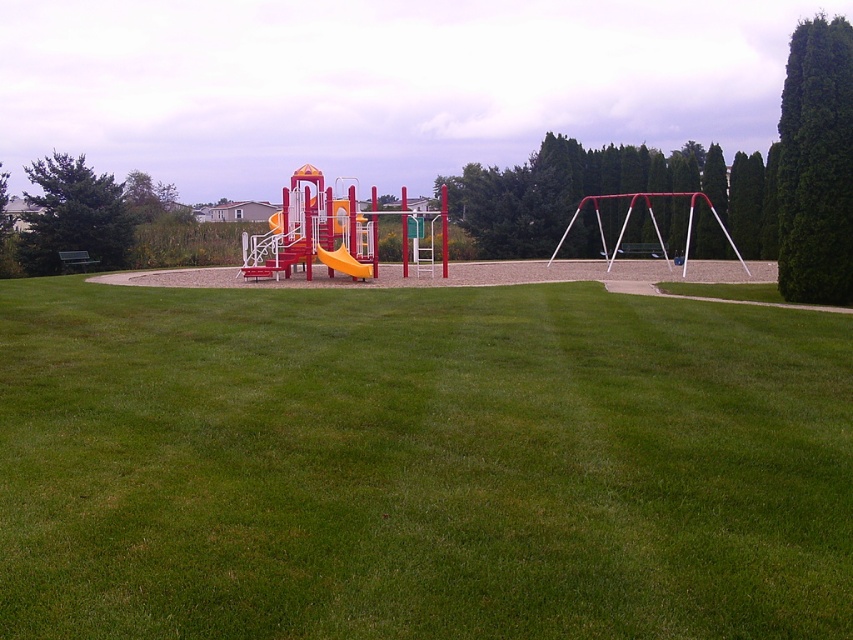
Who is positioned more to the right, green grassy field at center or green leafy cypress tree at left?

green grassy field at center

Is green grassy field at center positioned behind green leafy cypress tree at left?

No, it is not.

Does point (175, 371) lie behind point (86, 172)?

That is False.

Where is `green grassy field at center`? green grassy field at center is located at coordinates (419, 464).

Is green leafy cypress at upper right shorter than orange matte slide at center?

No.

Is green leafy cypress at upper right thinner than orange matte slide at center?

No, green leafy cypress at upper right is not thinner than orange matte slide at center.

The image size is (853, 640). Find the location of `green leafy cypress at upper right`. green leafy cypress at upper right is located at coordinates (816, 164).

Where is `green leafy cypress at upper right`? The height and width of the screenshot is (640, 853). green leafy cypress at upper right is located at coordinates (816, 164).

Can you confirm if green grassy field at center is thinner than orange matte slide at center?

No, green grassy field at center is not thinner than orange matte slide at center.

Is point (670, 538) positioned behind point (364, 275)?

No.

Between point (801, 618) and point (363, 276), which one is positioned in front?

Positioned in front is point (801, 618).

In order to click on green grassy field at center in this screenshot , I will do `click(419, 464)`.